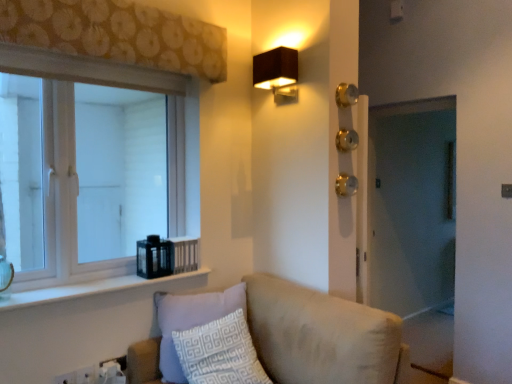
Question: From the image's perspective, does gold metallic door handle at center-right appear higher than white glossy window sill at lower left?

Choices:
 (A) yes
 (B) no

Answer: (A)

Question: Is gold metallic door handle at center-right next to white glossy window sill at lower left?

Choices:
 (A) yes
 (B) no

Answer: (B)

Question: From the image's perspective, is gold metallic door handle at center-right beneath white glossy window sill at lower left?

Choices:
 (A) yes
 (B) no

Answer: (B)

Question: Does gold metallic door handle at center-right turn towards white glossy window sill at lower left?

Choices:
 (A) yes
 (B) no

Answer: (B)

Question: Is gold metallic door handle at center-right outside white glossy window sill at lower left?

Choices:
 (A) yes
 (B) no

Answer: (A)

Question: Is white plastic electric outlet at lower left, positioned as the second electric outlet in right-to-left order, to the left or to the right of matte brown rectangular light fixture at upper right in the image?

Choices:
 (A) right
 (B) left

Answer: (B)

Question: Is white plastic electric outlet at lower left, positioned as the second electric outlet in right-to-left order, wider or thinner than matte brown rectangular light fixture at upper right?

Choices:
 (A) thin
 (B) wide

Answer: (A)

Question: From the image's perspective, is white plastic electric outlet at lower left, which ranks as the first electric outlet in front-to-back order, positioned above or below matte brown rectangular light fixture at upper right?

Choices:
 (A) above
 (B) below

Answer: (B)

Question: Would you say white plastic electric outlet at lower left, the first electric outlet from the left, is inside or outside matte brown rectangular light fixture at upper right?

Choices:
 (A) inside
 (B) outside

Answer: (B)

Question: Looking at the image, does white plastic electric outlet at lower left, the first electric outlet from the left, seem bigger or smaller compared to gold metallic door handle at center-right?

Choices:
 (A) small
 (B) big

Answer: (A)

Question: Considering the positions of white plastic electric outlet at lower left, the first electric outlet from the left, and gold metallic door handle at center-right in the image, is white plastic electric outlet at lower left, the first electric outlet from the left, wider or thinner than gold metallic door handle at center-right?

Choices:
 (A) wide
 (B) thin

Answer: (B)

Question: Is point (62, 377) closer or farther from the camera than point (343, 180)?

Choices:
 (A) closer
 (B) farther

Answer: (A)

Question: Is white plastic electric outlet at lower left, positioned as the second electric outlet in right-to-left order, taller or shorter than gold metallic door handle at center-right?

Choices:
 (A) short
 (B) tall

Answer: (A)

Question: Is brown floral fabric at upper left to the left or to the right of beige fabric couch at lower center in the image?

Choices:
 (A) right
 (B) left

Answer: (B)

Question: Based on their sizes in the image, would you say brown floral fabric at upper left is bigger or smaller than beige fabric couch at lower center?

Choices:
 (A) small
 (B) big

Answer: (A)